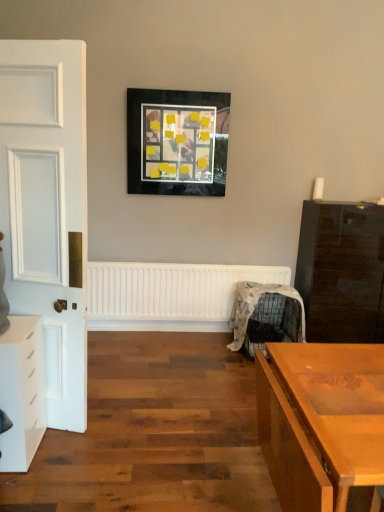
Where is `free spot to the left of metallic wire swivel chair at center-right`? This screenshot has height=512, width=384. free spot to the left of metallic wire swivel chair at center-right is located at coordinates (202, 351).